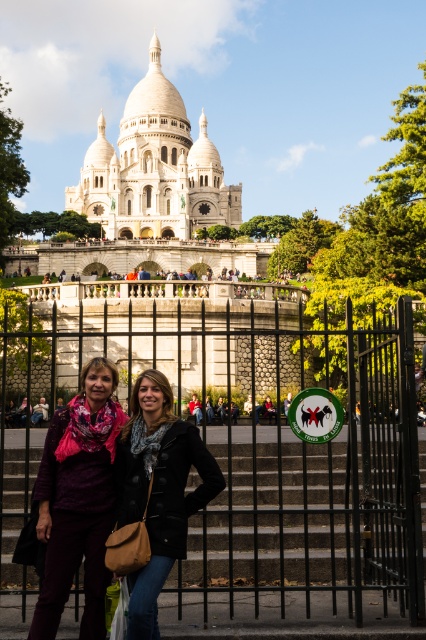
You are a tourist visiting Montmartre and want to take a photo of the white stone palace at upper center while also including the matte purple scarf at center in the frame. Based on their positions, will you need to adjust your camera angle upwards or downwards to include both in the photo?

The white stone palace at upper center is above the matte purple scarf at center, so you will need to adjust your camera angle downwards to include both in the photo.

You are a tourist standing at the base of the hill in Montmartre, Paris. You see the black wrought iron gate at center and the white stone palace at upper center. Which object is closer to you?

The black wrought iron gate at center is closer to you because it is located below the white stone palace at upper center, indicating it is positioned lower in the scene.

You are a photographer aiming to capture the iconic Basilica of the Sacred Heart in the background while focusing on the two individuals in front of the black wrought iron gate. Since you want the matte purple scarf at center and the black leather jacket at center to be clearly visible in the photo, which object should be placed to the left in your frame?

The matte purple scarf at center should be placed to the left of the black leather jacket at center in your frame, as it is positioned on the left side of the black leather jacket at center according to the description.